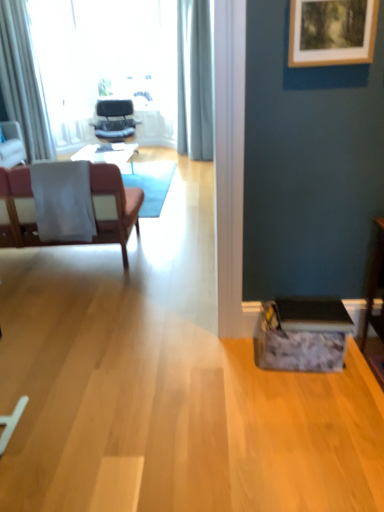
Question: In terms of width, does matte black chair at center, acting as the third chair starting from the front, look wider or thinner when compared to pink fabric chair at left, the third chair from the left?

Choices:
 (A) thin
 (B) wide

Answer: (B)

Question: Looking at the image, does matte black chair at center, arranged as the second chair when viewed from the right, seem bigger or smaller compared to pink fabric chair at left, the 3th chair when ordered from back to front?

Choices:
 (A) small
 (B) big

Answer: (A)

Question: Based on their relative distances, which object is farther from the pink fabric chair at left, arranged as the 3th chair when viewed from the top?

Choices:
 (A) matte black chair at center, acting as the third chair starting from the front
 (B) white sheer curtain at left, the first curtain when ordered from left to right
 (C) matte pink chair at left, placed as the second chair when sorted from top to bottom
 (D) wooden picture frame at upper right
 (E) light gray fabric curtain at upper center, the 1th curtain positioned from the right

Answer: (E)

Question: Estimate the real-world distances between objects in this image. Which object is farther from the matte pink chair at left, placed as the second chair when sorted from top to bottom?

Choices:
 (A) matte black chair at center, arranged as the second chair when viewed from the right
 (B) wooden picture frame at upper right
 (C) white sheer curtain at left, the 2th curtain in the right-to-left sequence
 (D) pink fabric chair at left, the first chair from the right
 (E) light gray fabric curtain at upper center, acting as the second curtain starting from the left

Answer: (E)